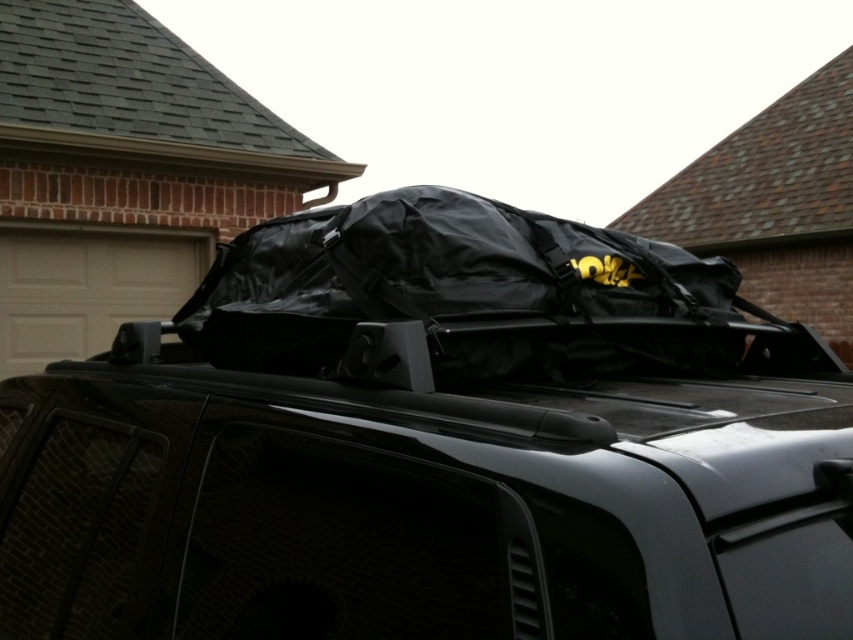
You are a delivery person trying to load a package onto the roof of the Jeep. The package requires a minimum clearance of 5 meters between the top of the package and the nearest obstruction. The nearest obstruction is the gray shingles at upper left. Can you safely place the package on the black rubberized bag at center?

The black rubberized bag at center is 4.76 meters from the gray shingles at upper left. Since the required clearance is 5 meters and the distance is less than that, placing the package would not meet the safety requirement. Therefore, it is not safe to place the package there.

Looking at this image, you are a delivery person trying to load a new package onto the roof of the Jeep. The package is the same size as the gray shingles at upper left. Can the black rubberized bag at center on the roof currently fit another package of that size without removing anything?

The black rubberized bag at center is smaller than the gray shingles at upper left. Since the package is the same size as the gray shingles at upper left, which are larger than the bag, the existing bag might not leave enough space for the new package unless there is additional room on the luggage rack. However, the description only mentions the size comparison between the bag and shingles, not the available space. Therefore, it is uncertain if there is enough space without more information.